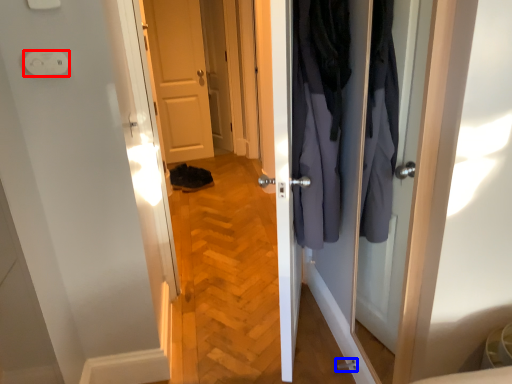
Question: Among these objects, which one is nearest to the camera, electric outlet (highlighted by a red box) or door handle (highlighted by a blue box)?

Choices:
 (A) electric outlet
 (B) door handle

Answer: (A)